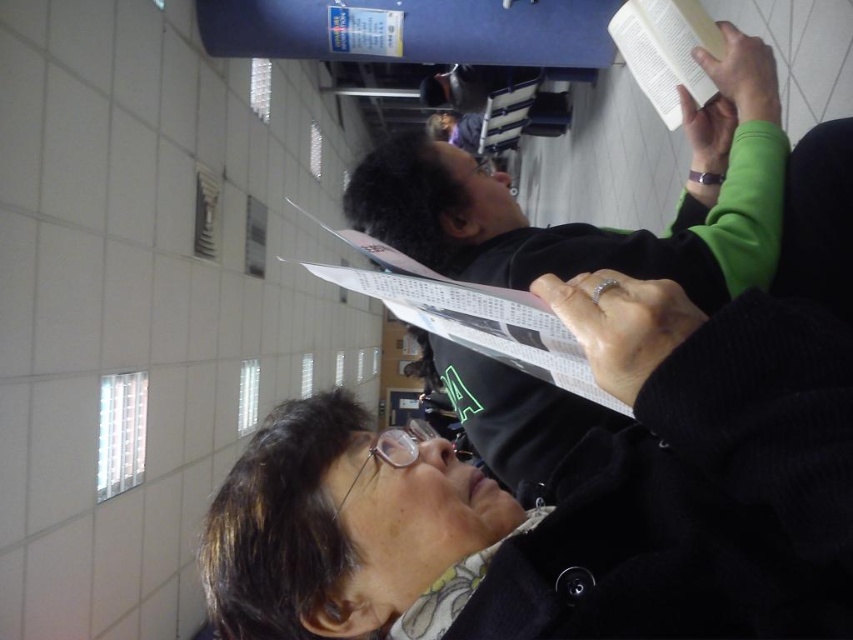
Question: Which point is farther to the camera?

Choices:
 (A) (416, 292)
 (B) (672, 8)

Answer: (B)

Question: Does paper at center appear under white paper book at upper right?

Choices:
 (A) no
 (B) yes

Answer: (B)

Question: Does black matte paper at center have a smaller size compared to paper at center?

Choices:
 (A) no
 (B) yes

Answer: (A)

Question: Among these objects, which one is nearest to the camera?

Choices:
 (A) black matte book at upper center
 (B) paper at center
 (C) white paper book at upper right
 (D) black matte paper at center

Answer: (D)

Question: Is black matte paper at center positioned in front of paper at center?

Choices:
 (A) no
 (B) yes

Answer: (B)

Question: Which point is farther from the camera taking this photo?

Choices:
 (A) (659, 83)
 (B) (608, 604)
 (C) (378, 298)
 (D) (527, 394)

Answer: (A)